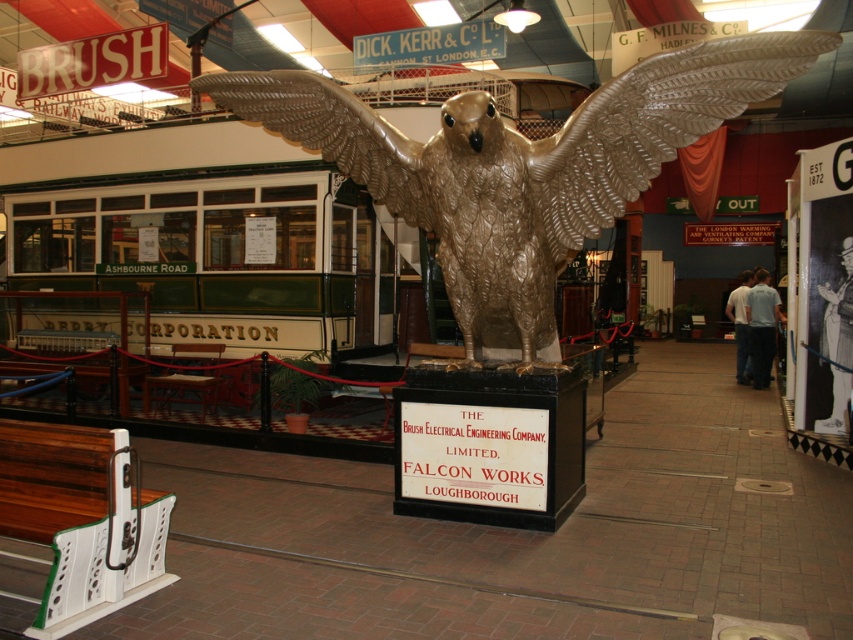
Question: Considering the relative positions of gold metallic eagle at center and gold metallic wing at upper center in the image provided, where is gold metallic eagle at center located with respect to gold metallic wing at upper center?

Choices:
 (A) below
 (B) above

Answer: (A)

Question: Based on their relative distances, which object is farther from the gold metallic eagle at center?

Choices:
 (A) gold metallic wing at upper center
 (B) metallic gold wing at center

Answer: (A)

Question: Which point is farther to the camera?

Choices:
 (A) metallic gold wing at center
 (B) gold metallic wing at upper center

Answer: (A)

Question: Which point is farther from the camera taking this photo?

Choices:
 (A) (691, 109)
 (B) (627, 134)

Answer: (B)

Question: Observing the image, what is the correct spatial positioning of gold metallic eagle at center in reference to gold metallic wing at upper center?

Choices:
 (A) left
 (B) right

Answer: (A)

Question: Is gold metallic eagle at center thinner than metallic gold wing at center?

Choices:
 (A) no
 (B) yes

Answer: (A)